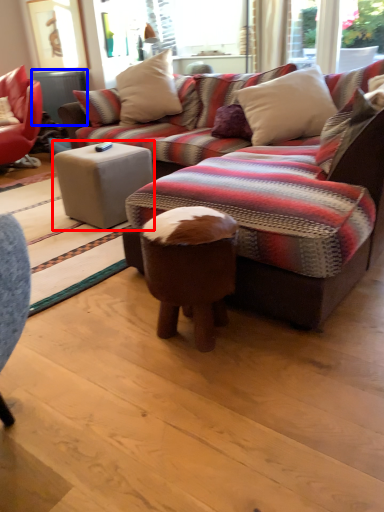
Question: Which point is closer to the camera, table (highlighted by a red box) or table (highlighted by a blue box)?

Choices:
 (A) table
 (B) table

Answer: (A)